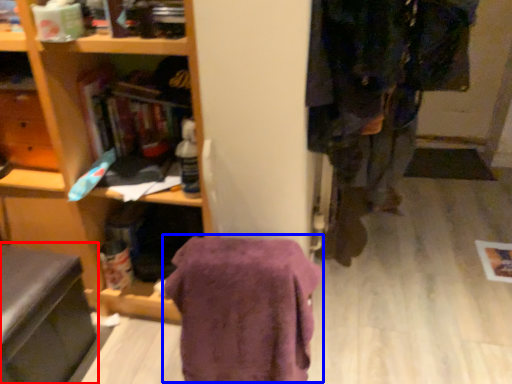
Question: Which point is closer to the camera, swivel chair (highlighted by a red box) or blanket (highlighted by a blue box)?

Choices:
 (A) swivel chair
 (B) blanket

Answer: (B)